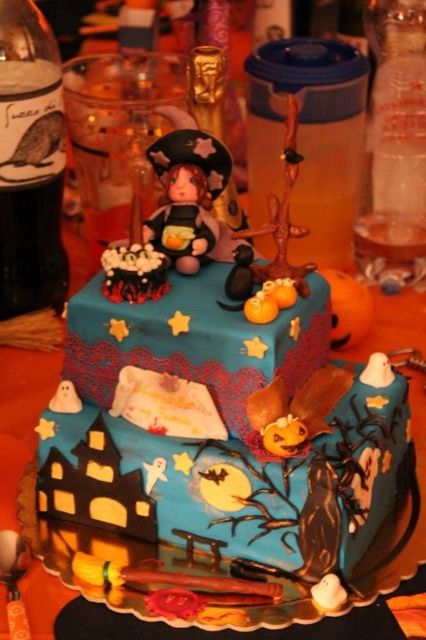
Looking at this image, between translucent glass bottle at left and matte plastic witch at center, which one is positioned lower?

matte plastic witch at center is lower down.

Which of these two, translucent glass bottle at left or matte plastic witch at center, stands taller?

Standing taller between the two is translucent glass bottle at left.

Describe the element at coordinates (29, 163) in the screenshot. I see `translucent glass bottle at left` at that location.

Where is `translucent glass bottle at left`? translucent glass bottle at left is located at coordinates (29, 163).